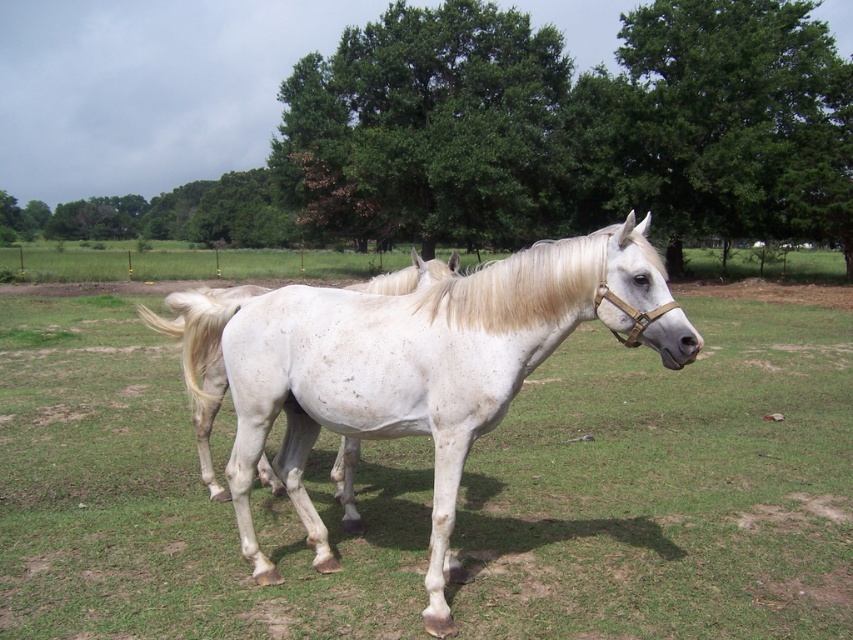
Question: Which point is closer to the camera?

Choices:
 (A) green leafy tree at upper center
 (B) white silky mane at center

Answer: (B)

Question: Does green leafy tree at upper center have a larger size compared to white silky mane at center?

Choices:
 (A) yes
 (B) no

Answer: (A)

Question: Considering the relative positions of blonde silky mane at center and white silky mane at center in the image provided, where is blonde silky mane at center located with respect to white silky mane at center?

Choices:
 (A) above
 (B) below

Answer: (B)

Question: Which of the following is the farthest from the observer?

Choices:
 (A) green leafy tree at center
 (B) blonde silky mane at center
 (C) green leafy tree at upper center

Answer: (A)

Question: Which object is the closest to the green leafy tree at center?

Choices:
 (A) blonde silky mane at center
 (B) white silky mane at center

Answer: (B)

Question: Does white matte horse at center have a lesser width compared to white silky mane at center?

Choices:
 (A) yes
 (B) no

Answer: (A)